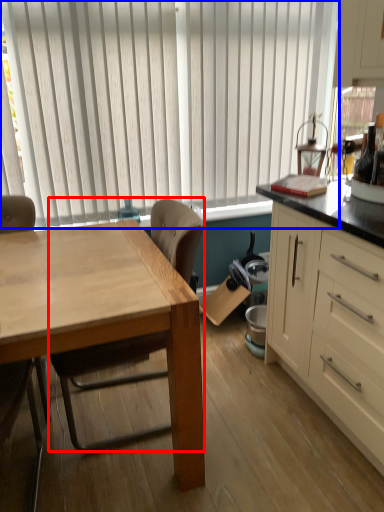
Question: Among these objects, which one is nearest to the camera, chair (highlighted by a red box) or window blind (highlighted by a blue box)?

Choices:
 (A) chair
 (B) window blind

Answer: (A)